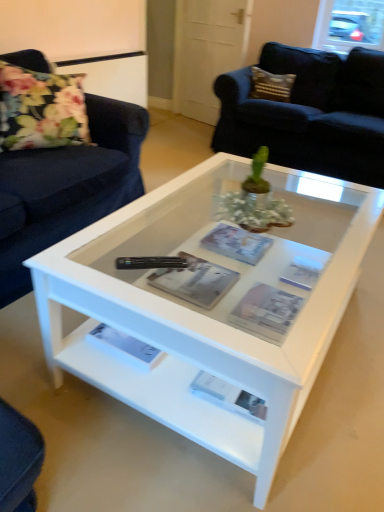
Question: Is floral fabric pillow at left wider or thinner than black plastic remote at center?

Choices:
 (A) thin
 (B) wide

Answer: (B)

Question: Considering their positions, is floral fabric pillow at left located in front of or behind black plastic remote at center?

Choices:
 (A) front
 (B) behind

Answer: (B)

Question: Which object is the closest to the floral fabric pillow at left?

Choices:
 (A) black plastic remote at center
 (B) matte gray magazine at center, which appears as the 3th magazine when viewed from the back
 (C) white glossy coffee table at center
 (D) matte gray magazine at center, which appears as the third magazine when viewed from the front
 (E) suede-like brown pillow at upper right

Answer: (C)

Question: Which of these objects is positioned farthest from the matte paper magazine at center, the 2th magazine viewed from the front?

Choices:
 (A) suede-like brown pillow at upper right
 (B) white glossy coffee table at center
 (C) floral fabric pillow at left
 (D) matte gray magazine at center, which appears as the 3th magazine when viewed from the back
 (E) black plastic remote at center

Answer: (A)